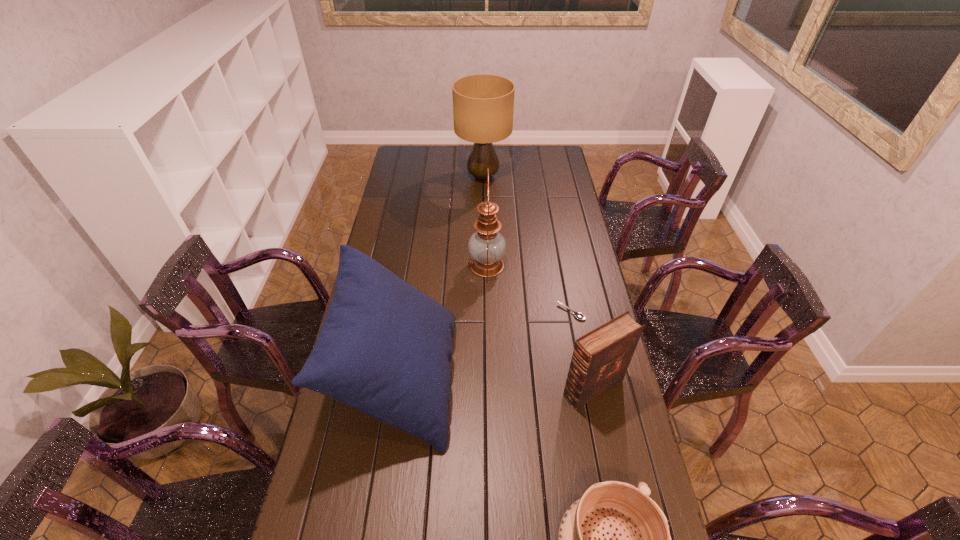
This screenshot has height=540, width=960. I want to click on free area in between the fifth nearest object and the fourth tallest object, so click(x=540, y=327).

The width and height of the screenshot is (960, 540). What are the coordinates of `vacant space that is in between the soupspoon and the lampshade` in the screenshot? It's located at (527, 245).

Locate an element on the screen. free spot between the shortest object and the third tallest object is located at coordinates (486, 345).

Identify which object is the nearest to the shortest object. Please provide its 2D coordinates. Your answer should be formatted as a tuple, i.e. [(x, y)], where the tuple contains the x and y coordinates of a point satisfying the conditions above.

[(600, 359)]

Point out which object is positioned as the third nearest to the oil lamp. Please provide its 2D coordinates. Your answer should be formatted as a tuple, i.e. [(x, y)], where the tuple contains the x and y coordinates of a point satisfying the conditions above.

[(600, 359)]

This screenshot has height=540, width=960. What are the coordinates of `vacant space that satisfies the following two spatial constraints: 1. on the front side of the soupspoon; 2. on the right side of the third shortest object` in the screenshot? It's located at (586, 388).

Image resolution: width=960 pixels, height=540 pixels. What are the coordinates of `free space that satisfies the following two spatial constraints: 1. on the front side of the farthest object; 2. on the right side of the second farthest object` in the screenshot? It's located at (484, 265).

I want to click on blank space that satisfies the following two spatial constraints: 1. on the facing side of the third shortest object; 2. on the right side of the fourth shortest object, so pyautogui.click(x=398, y=388).

I want to click on blank area in the image that satisfies the following two spatial constraints: 1. on the front side of the oil lamp; 2. on the left side of the soupspoon, so [488, 312].